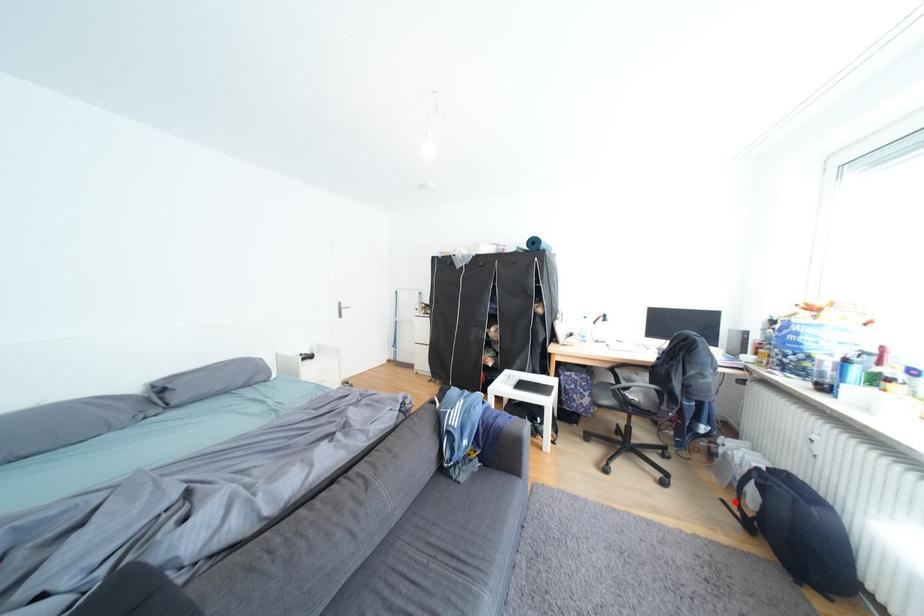
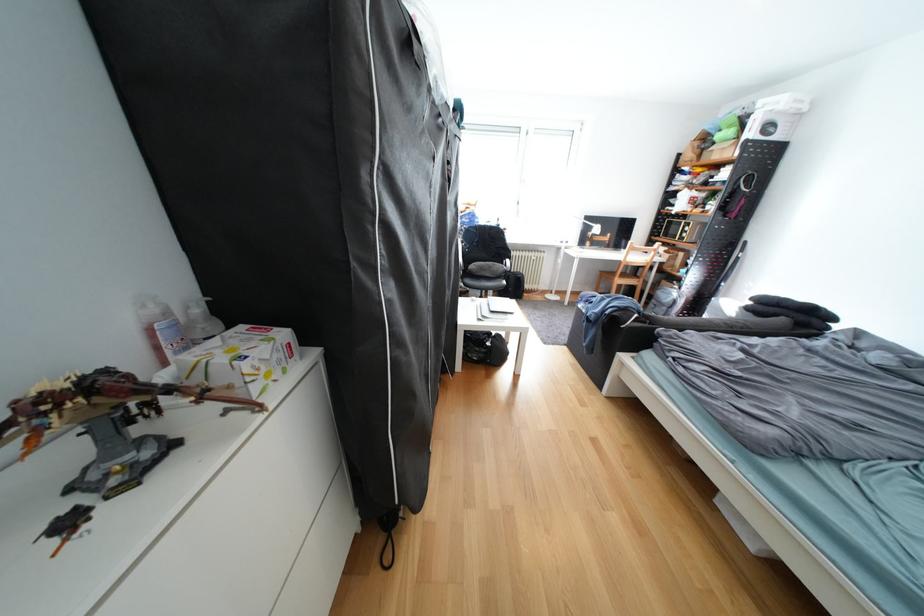
Question: I am providing you with two images of the same scene from different viewpoints. A red point is marked on the first image. Can you still see the location of the red point in image 2?

Choices:
 (A) Yes
 (B) No

Answer: (B)